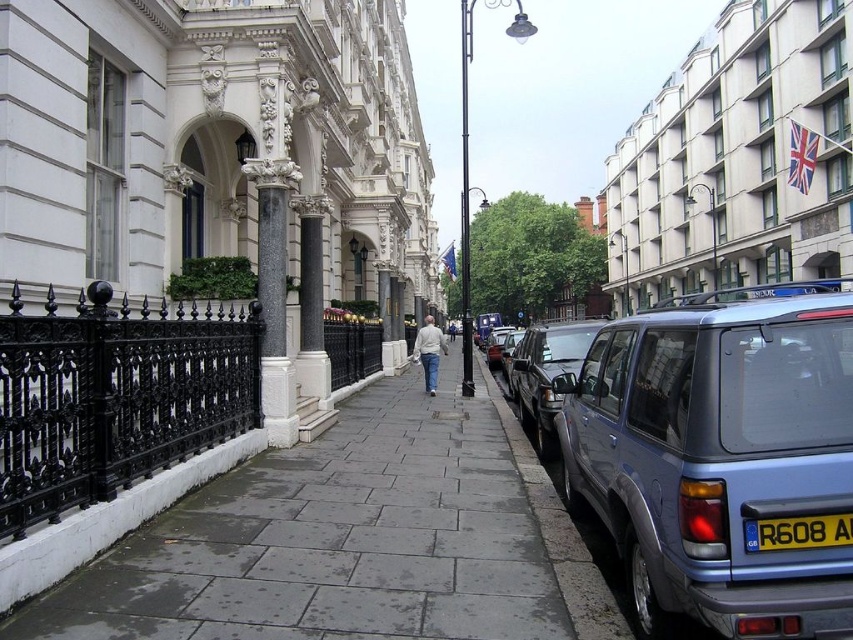
Who is positioned more to the left, gray concrete curb at lower right or black granite column at center?

From the viewer's perspective, black granite column at center appears more on the left side.

Who is shorter, gray concrete curb at lower right or black granite column at center?

gray concrete curb at lower right is shorter.

This screenshot has height=640, width=853. Describe the element at coordinates (558, 532) in the screenshot. I see `gray concrete curb at lower right` at that location.

Locate an element on the screen. gray concrete curb at lower right is located at coordinates (558, 532).

Consider the image. Is the position of gray concrete sidewalk at center more distant than that of light gray sweater at center?

That is False.

Locate an element on the screen. gray concrete sidewalk at center is located at coordinates (334, 540).

Can you confirm if gray concrete curb at lower right is smaller than metallic silver suv at center?

Yes, gray concrete curb at lower right is smaller than metallic silver suv at center.

Is gray concrete curb at lower right below metallic silver suv at center?

Indeed, gray concrete curb at lower right is positioned under metallic silver suv at center.

Who is more distant from viewer, [495,410] or [496,365]?

Point [496,365]

You are a GUI agent. You are given a task and a screenshot of the screen. Output one action in this format:
    pyautogui.click(x=<x>, y=<y>)
    Task: Click on the gray concrete curb at lower right
    The image size is (853, 640).
    Given the screenshot: What is the action you would take?
    pyautogui.click(x=558, y=532)